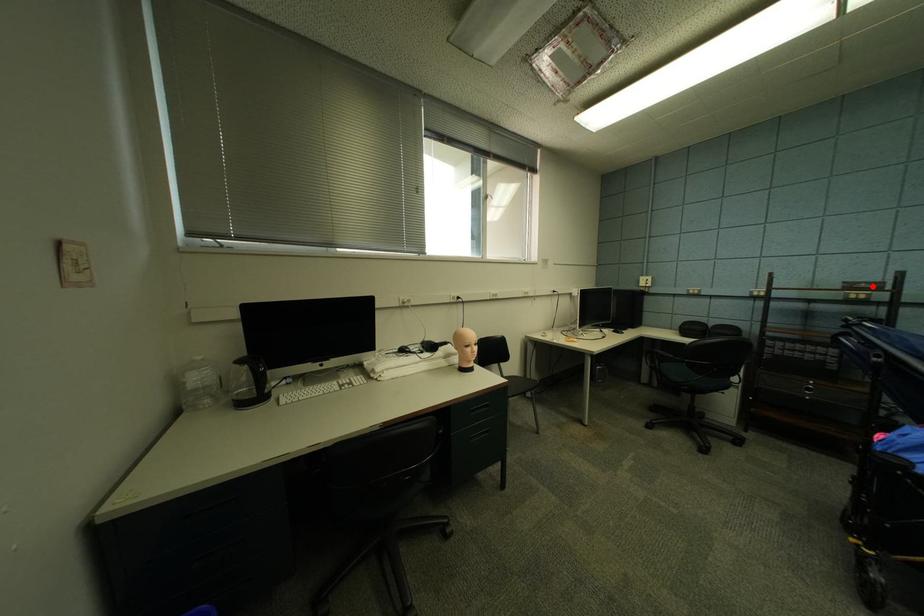
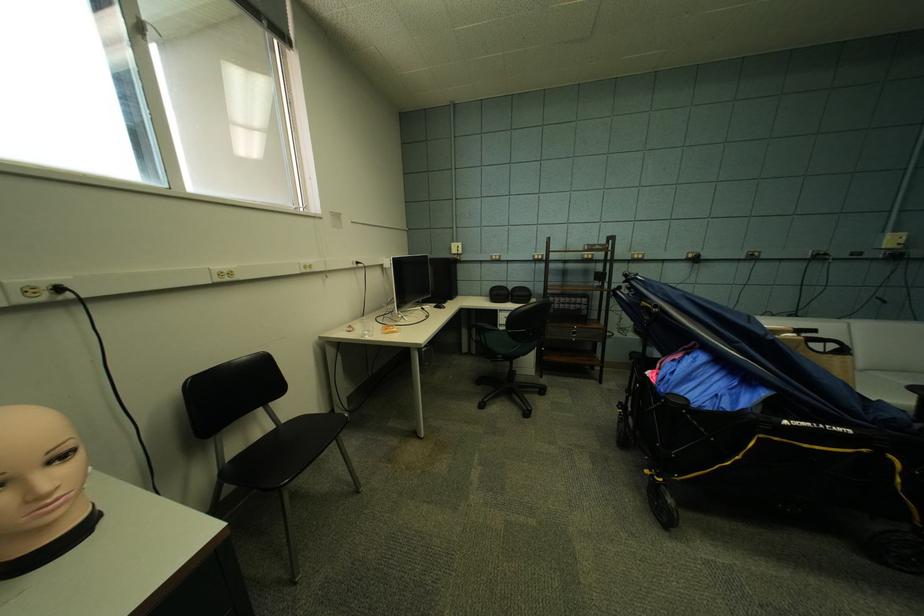
Question: I am providing you with two images of the same scene from different viewpoints. A red point is marked on the first image. Is the red point's position out of view in image 2?

Choices:
 (A) Yes
 (B) No

Answer: (B)